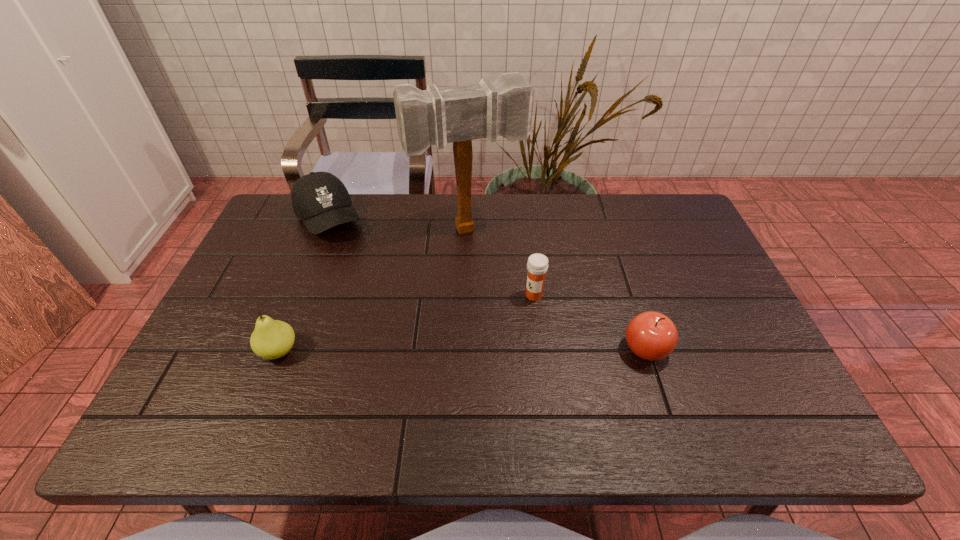
Locate an element on the screen. Image resolution: width=960 pixels, height=540 pixels. free space on the desktop that is between the pear and the rightmost object and is positioned at the head of the tallest object is located at coordinates (517, 350).

This screenshot has width=960, height=540. In order to click on free space on the desktop that is between the pear and the rightmost object and is positioned on the front-facing side of the baseball cap in this screenshot , I will do `click(410, 350)`.

You are a GUI agent. You are given a task and a screenshot of the screen. Output one action in this format:
    pyautogui.click(x=<x>, y=<y>)
    Task: Click on the free spot on the desktop that is between the pear and the rightmost object and is positioned on the label side of the third farthest object
    The width and height of the screenshot is (960, 540).
    Given the screenshot: What is the action you would take?
    pyautogui.click(x=453, y=350)